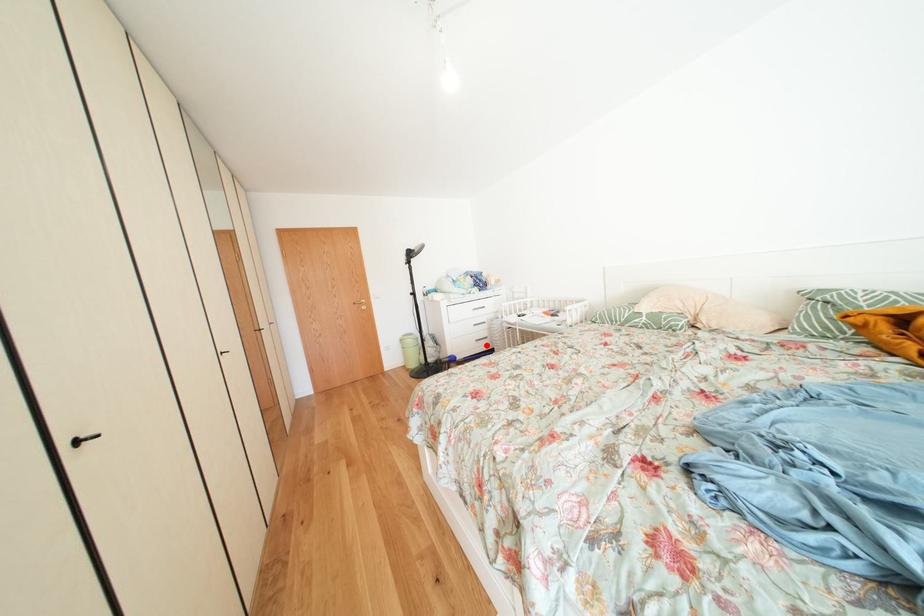
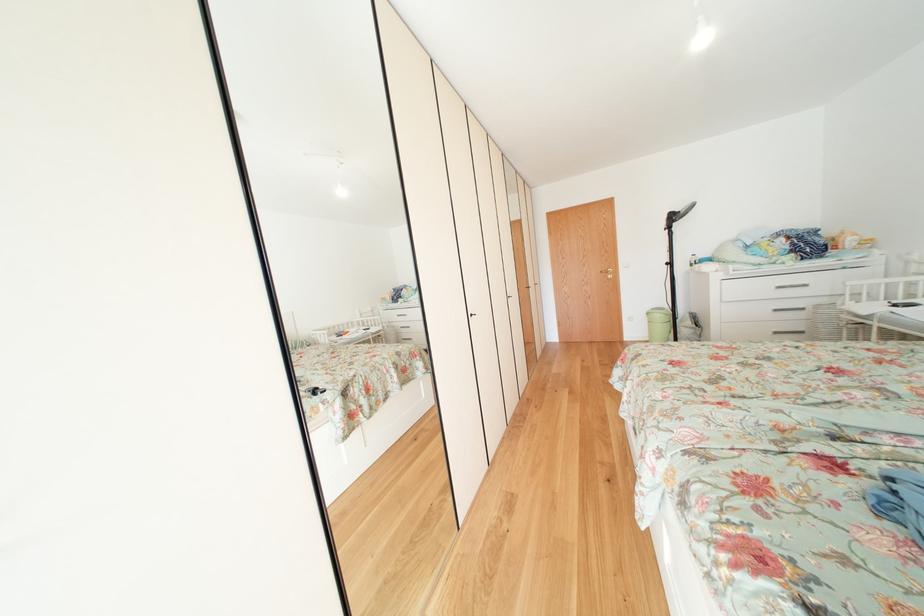
The point at the highlighted location is marked in the first image. Where is the corresponding point in the second image?

(784, 338)